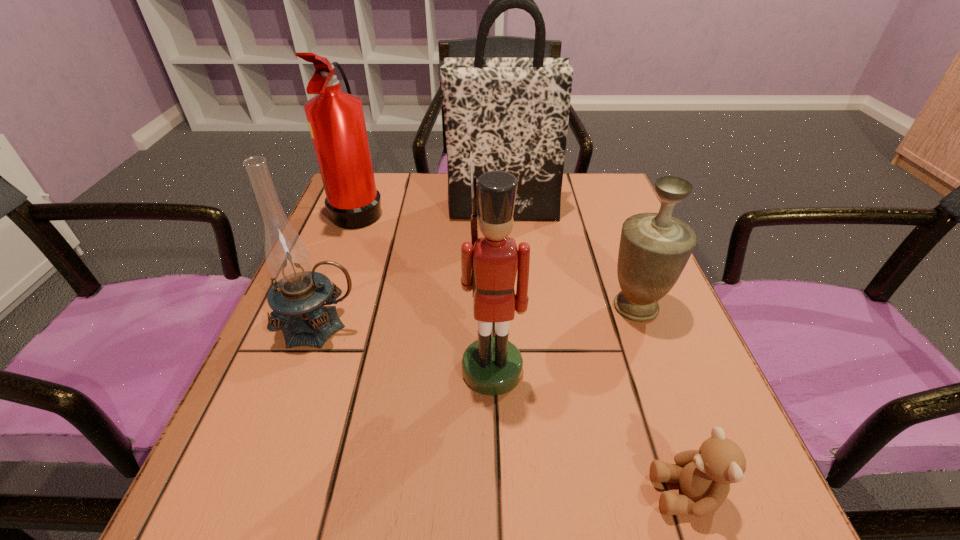
You are a GUI agent. You are given a task and a screenshot of the screen. Output one action in this format:
    pyautogui.click(x=<x>, y=<y>)
    Task: Click on the shopping bag
    
    Given the screenshot: What is the action you would take?
    pyautogui.click(x=512, y=113)

Locate an element on the screen. The image size is (960, 540). fire extinguisher is located at coordinates (336, 121).

At what (x,y) coordinates should I click in order to perform the action: click on nutcracker. Please return your answer as a coordinate pair (x, y). This screenshot has width=960, height=540. Looking at the image, I should click on pyautogui.click(x=492, y=366).

I want to click on oil lamp, so click(x=298, y=295).

The width and height of the screenshot is (960, 540). I want to click on urn, so click(x=654, y=248).

Where is `the shortest object`? the shortest object is located at coordinates (704, 475).

Locate an element on the screen. The image size is (960, 540). teddy bear is located at coordinates (704, 475).

The width and height of the screenshot is (960, 540). In order to click on vacant space located 0.180m on the front of the shopping bag with the design in this screenshot , I will do click(x=506, y=270).

Locate an element on the screen. This screenshot has width=960, height=540. free point located at the spray nozzle of the fire extinguisher is located at coordinates (409, 210).

Locate an element on the screen. This screenshot has height=540, width=960. vacant space situated 0.050m on the front-facing side of the nutcracker is located at coordinates (493, 425).